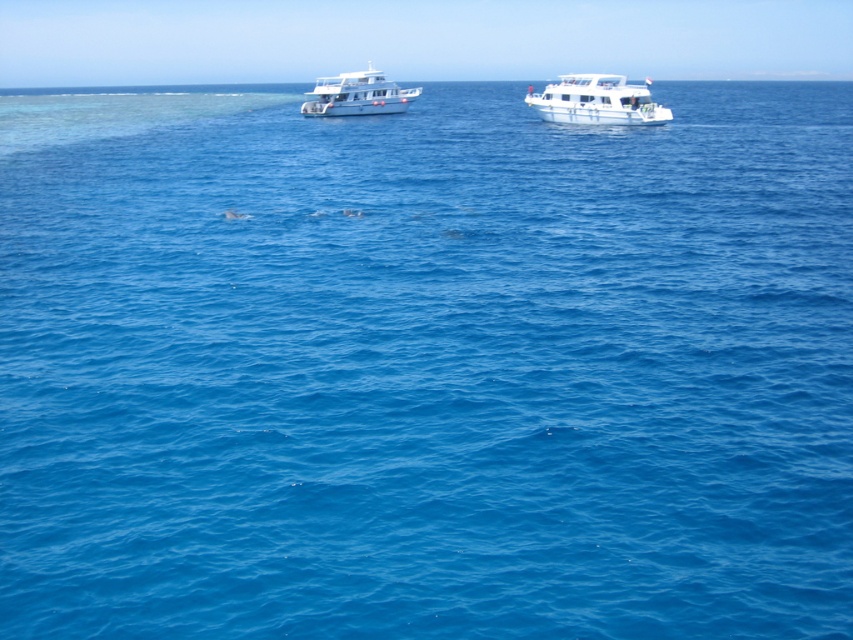
Who is taller, white glossy boat at upper right or white glossy boat at upper center?

white glossy boat at upper center is taller.

Image resolution: width=853 pixels, height=640 pixels. In order to click on white glossy boat at upper right in this screenshot , I will do `click(596, 100)`.

Is point (606, 88) positioned in front of point (334, 113)?

Yes.

In order to click on white glossy boat at upper right in this screenshot , I will do `click(596, 100)`.